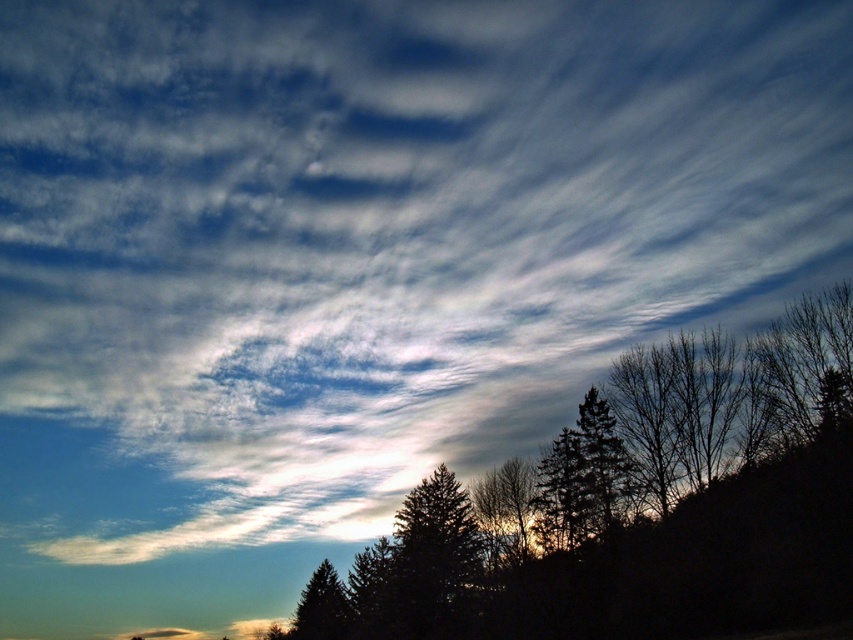
This screenshot has width=853, height=640. What do you see at coordinates (582, 480) in the screenshot? I see `dark green textured tree at center` at bounding box center [582, 480].

In the scene shown: Is dark green textured tree at center thinner than green matte tree at lower center?

Indeed, dark green textured tree at center has a lesser width compared to green matte tree at lower center.

What are the coordinates of `dark green textured tree at center` in the screenshot? It's located at (582, 480).

Find the location of a particular element. This screenshot has width=853, height=640. dark green textured tree at center is located at coordinates (582, 480).

Based on the photo, between silhouette evergreen tree at center and dark green textured tree at center, which one appears on the right side from the viewer's perspective?

dark green textured tree at center is more to the right.

Is point (819, 412) positioned in front of point (608, 486)?

Yes, it is in front of point (608, 486).

Is point (793, 454) farther from camera compared to point (550, 548)?

No, it is in front of (550, 548).

I want to click on silhouette evergreen tree at center, so click(647, 502).

Is silhouette evergreen tree at center in front of green matte tree at lower center?

Yes, it is.

Is point (668, 620) closer to camera compared to point (323, 584)?

Yes, point (668, 620) is closer to viewer.

Which is in front, point (796, 381) or point (299, 604)?

Point (796, 381) is more forward.

Identify the location of silhouette evergreen tree at center. (647, 502).